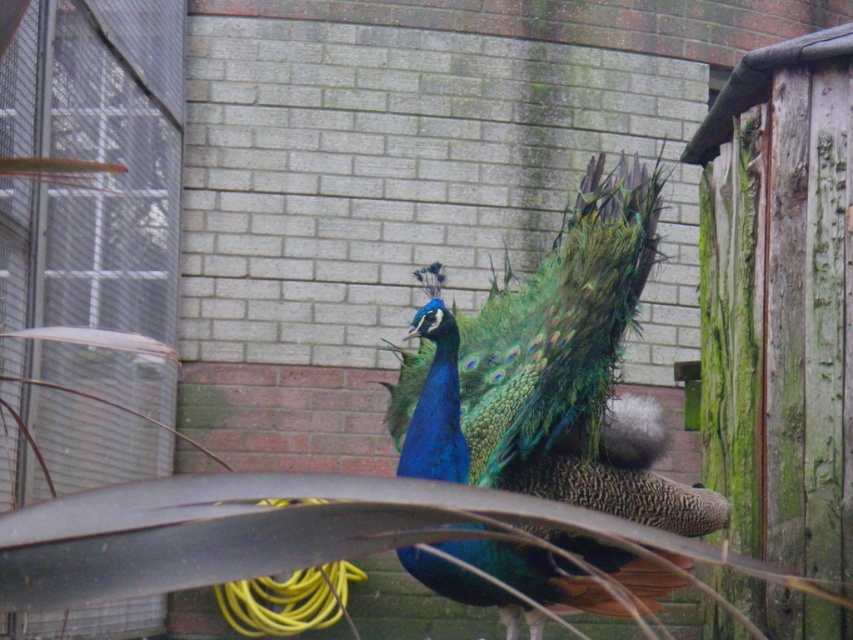
Does shiny blue peacock at center have a lesser width compared to yellow rubber hose at lower center?

No, shiny blue peacock at center is not thinner than yellow rubber hose at lower center.

Is shiny blue peacock at center further to the viewer compared to yellow rubber hose at lower center?

That is False.

Is point (590, 257) in front of point (253, 605)?

Yes, it is in front of point (253, 605).

The height and width of the screenshot is (640, 853). Find the location of `shiny blue peacock at center`. shiny blue peacock at center is located at coordinates (552, 372).